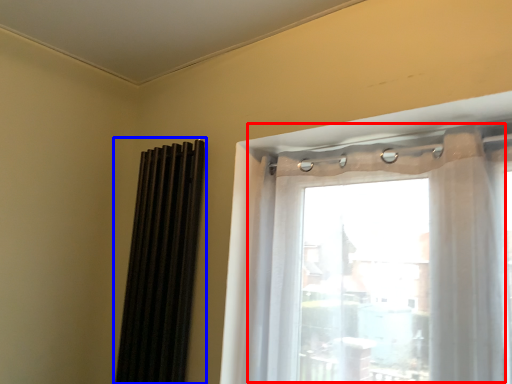
Question: Which of the following is the closest to the observer, window (highlighted by a red box) or shutter (highlighted by a blue box)?

Choices:
 (A) window
 (B) shutter

Answer: (A)